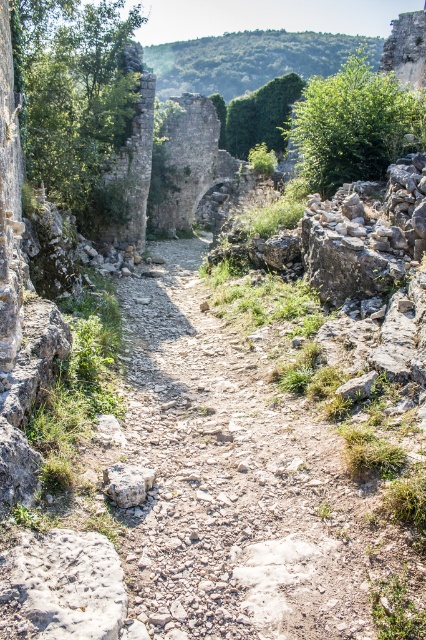
Is gray rough stone at lower left bigger than gray rough stone at center?

Correct, gray rough stone at lower left is larger in size than gray rough stone at center.

What do you see at coordinates (63, 586) in the screenshot? The image size is (426, 640). I see `gray rough stone at lower left` at bounding box center [63, 586].

This screenshot has width=426, height=640. In order to click on gray rough stone at lower left in this screenshot , I will do `click(63, 586)`.